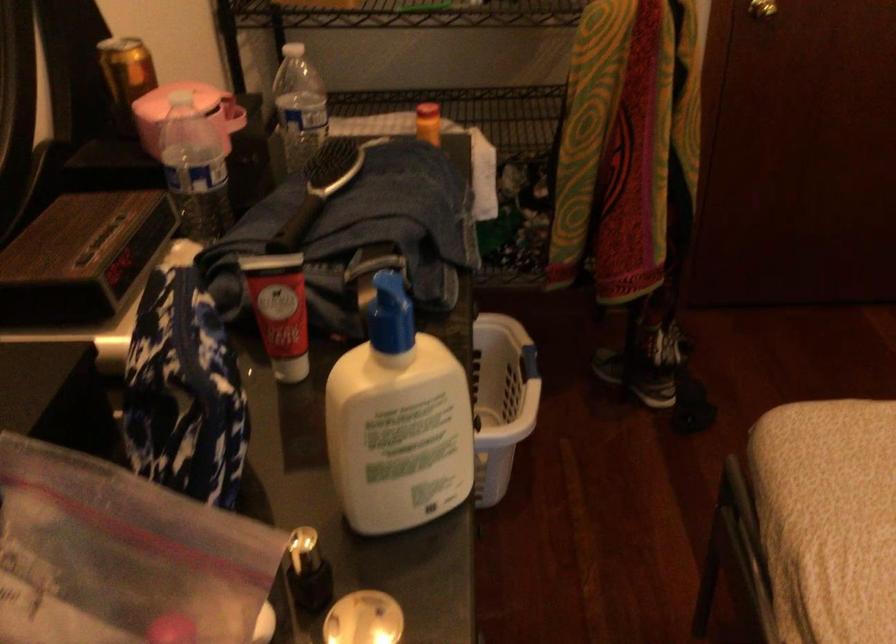
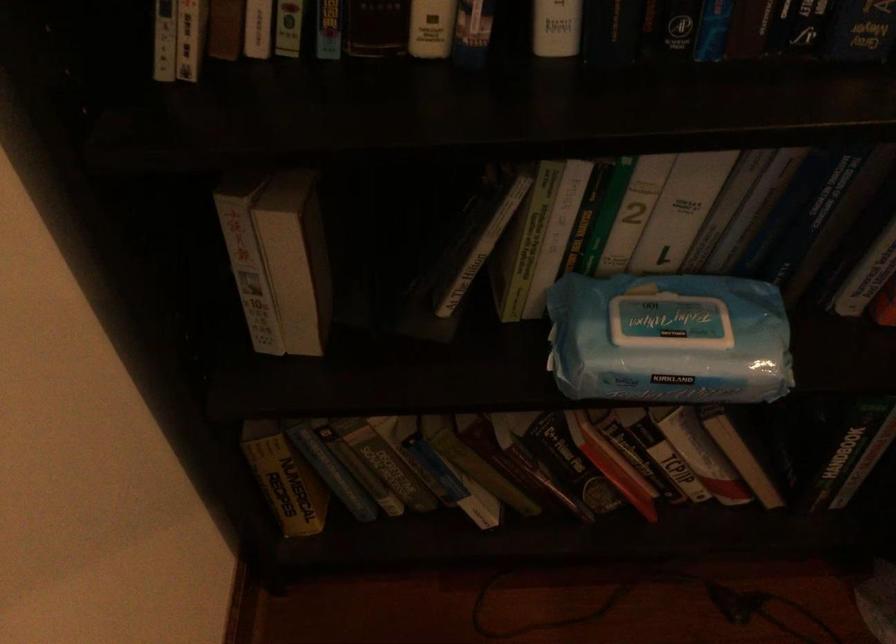
First-person continuous shooting, in which direction is the camera rotating?

The camera's rotation is toward left-down.